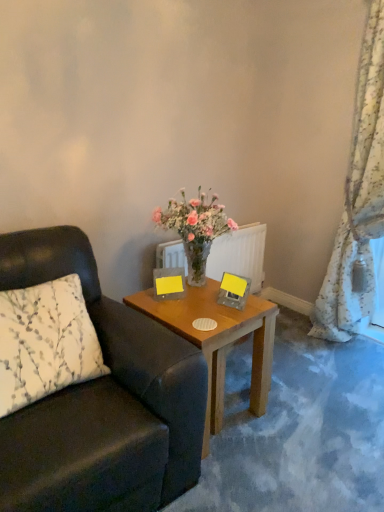
Identify the location of free spot in front of yellow paper at center, the 1th picture frame when ordered from right to left. This screenshot has width=384, height=512. (233, 318).